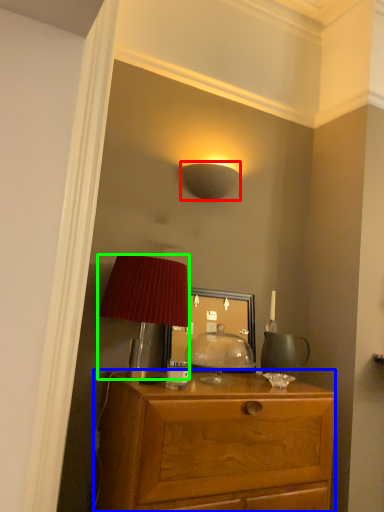
Question: Considering the real-world distances, which object is farthest from lamp (highlighted by a red box)? desk (highlighted by a blue box) or lamp (highlighted by a green box)?

Choices:
 (A) desk
 (B) lamp

Answer: (A)